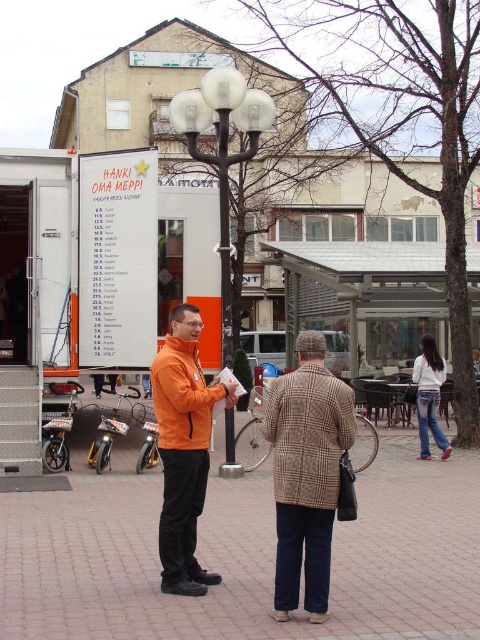
You are a tourist in this European city square. You see the brick pavement at center and the plaid wool coat at center. Which object is positioned to the left of the other?

The brick pavement at center is to the left of the plaid wool coat at center.

You are a photographer standing in the plaza. You want to take a photo that includes both the orange matte jacket at center and the white denim jeans at lower right. Which object should you focus on first to ensure both are in frame?

The orange matte jacket at center is taller than the white denim jeans at lower right. To ensure both are in frame, focus on the taller object first, which is the orange matte jacket at center.